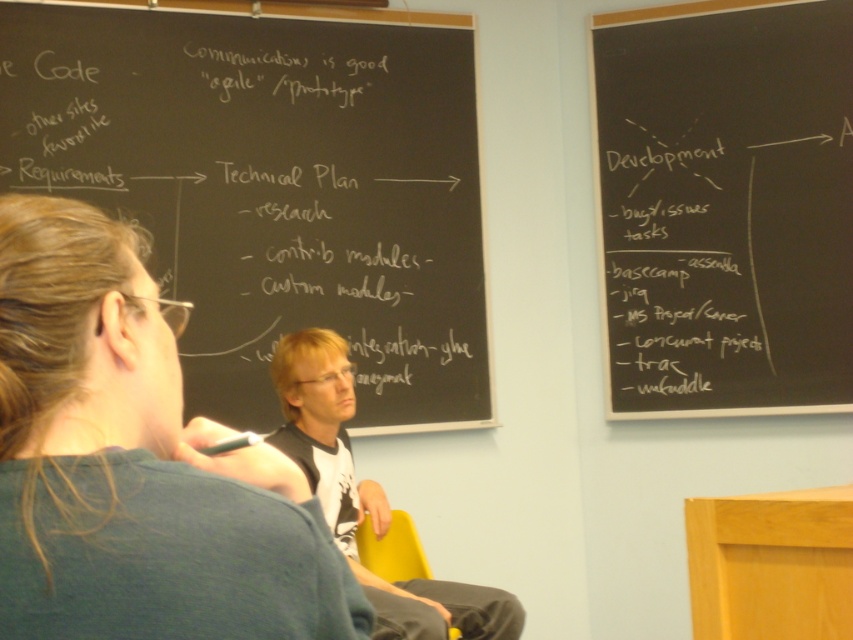
Is point (755, 56) in front of point (409, 524)?

No, (755, 56) is further to viewer.

Does white chalkboard at upper right lie in front of yellow plastic chair at lower center?

No, white chalkboard at upper right is behind yellow plastic chair at lower center.

What do you see at coordinates (724, 205) in the screenshot?
I see `white chalkboard at upper right` at bounding box center [724, 205].

Identify the location of white chalkboard at upper right. The width and height of the screenshot is (853, 640). (724, 205).

Does black chalkboard at upper left appear under light brown hair at center?

No, black chalkboard at upper left is not below light brown hair at center.

Is point (231, 36) positioned behind point (399, 618)?

That is True.

At what (x,y) coordinates should I click in order to perform the action: click on black chalkboard at upper left. Please return your answer as a coordinate pair (x, y). Looking at the image, I should click on (274, 186).

Can you confirm if black chalkboard at upper left is bigger than yellow plastic chair at lower center?

Indeed, black chalkboard at upper left has a larger size compared to yellow plastic chair at lower center.

This screenshot has width=853, height=640. What do you see at coordinates (274, 186) in the screenshot?
I see `black chalkboard at upper left` at bounding box center [274, 186].

Find the location of a particular element. black chalkboard at upper left is located at coordinates coord(274,186).